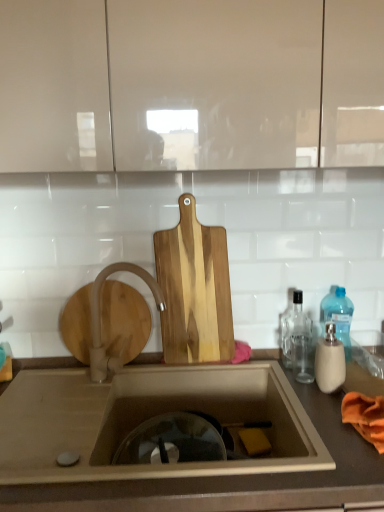
Image resolution: width=384 pixels, height=512 pixels. Find the location of `free spot to the left of transparent glass bottle at right, which ranks as the 2th bottle in back-to-front order`. free spot to the left of transparent glass bottle at right, which ranks as the 2th bottle in back-to-front order is located at coordinates (259, 364).